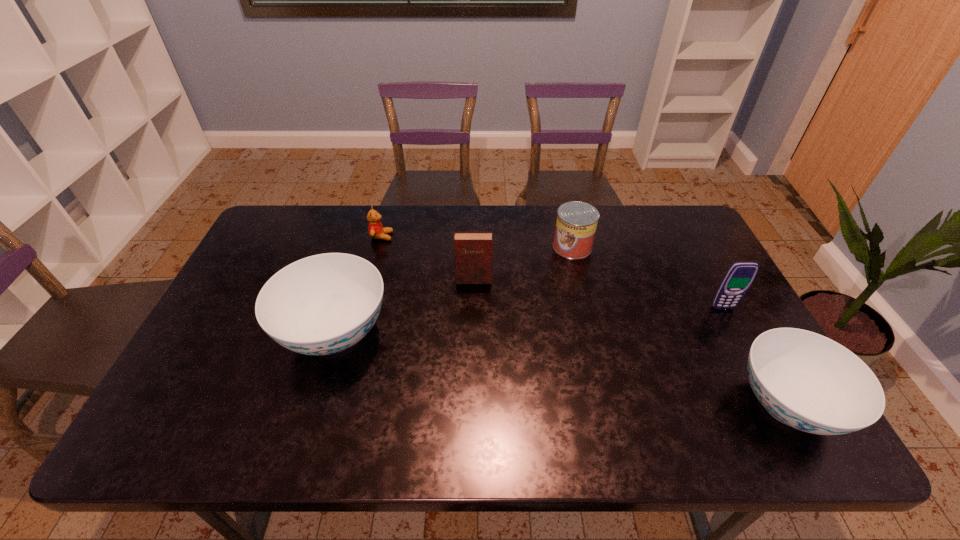
I want to click on free space located on the front-facing side of the cellular telephone, so click(x=739, y=339).

Where is `vacant space located on the left of the fourth object from left to right`? This screenshot has width=960, height=540. vacant space located on the left of the fourth object from left to right is located at coordinates (457, 247).

At what (x,y) coordinates should I click in order to perform the action: click on free spot located on the front cover of the fourth object from right to left. Please return your answer as a coordinate pair (x, y). The width and height of the screenshot is (960, 540). Looking at the image, I should click on (473, 309).

Image resolution: width=960 pixels, height=540 pixels. I want to click on teddy bear that is at the far edge, so click(x=375, y=228).

This screenshot has width=960, height=540. I want to click on can present at the far edge, so click(x=576, y=224).

Where is `chinaware at the right edge`? chinaware at the right edge is located at coordinates (805, 380).

The width and height of the screenshot is (960, 540). What are the coordinates of `cellular telephone present at the right edge` in the screenshot? It's located at (739, 277).

Where is `object that is at the near right corner`? This screenshot has width=960, height=540. object that is at the near right corner is located at coordinates (805, 380).

In the image, there is a desktop. Identify the location of free region at the far edge. The height and width of the screenshot is (540, 960). (359, 249).

In the image, there is a desktop. Where is `vacant space at the near edge`? This screenshot has width=960, height=540. vacant space at the near edge is located at coordinates (587, 389).